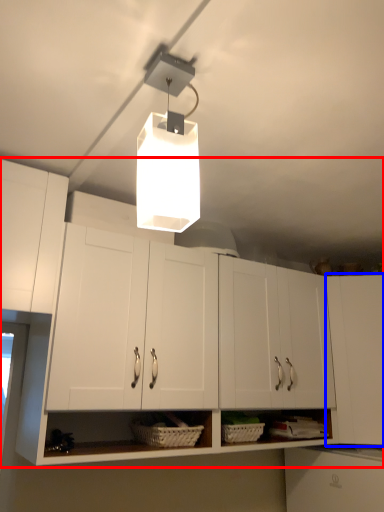
Question: Which point is closer to the camera, cabinetry (highlighted by a red box) or cabinetry (highlighted by a blue box)?

Choices:
 (A) cabinetry
 (B) cabinetry

Answer: (A)